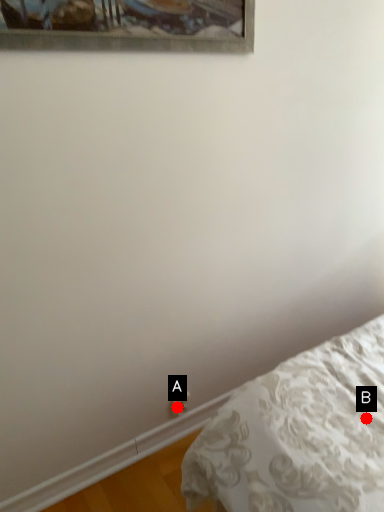
Question: Two points are circled on the image, labeled by A and B beside each circle. Which point is closer to the camera?

Choices:
 (A) A is closer
 (B) B is closer

Answer: (B)